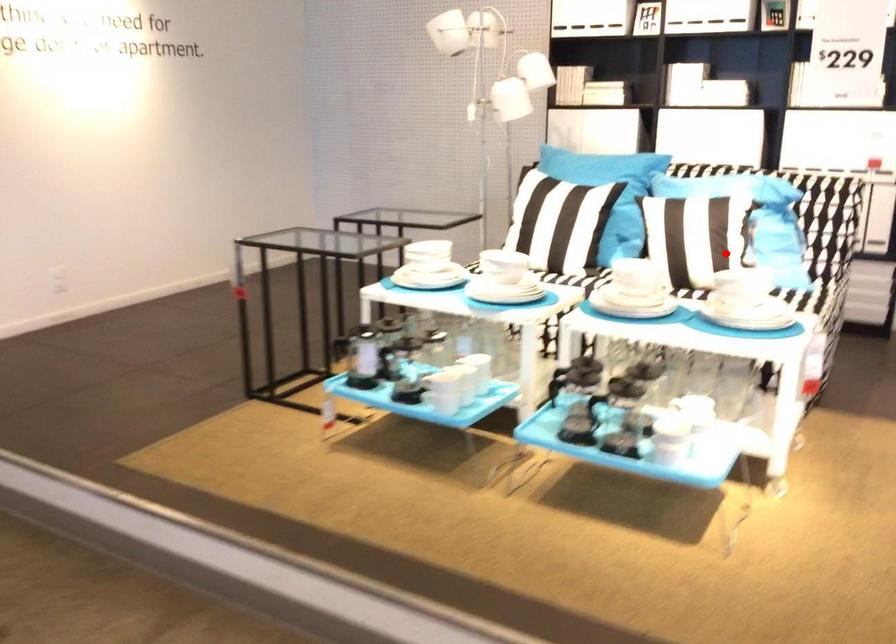
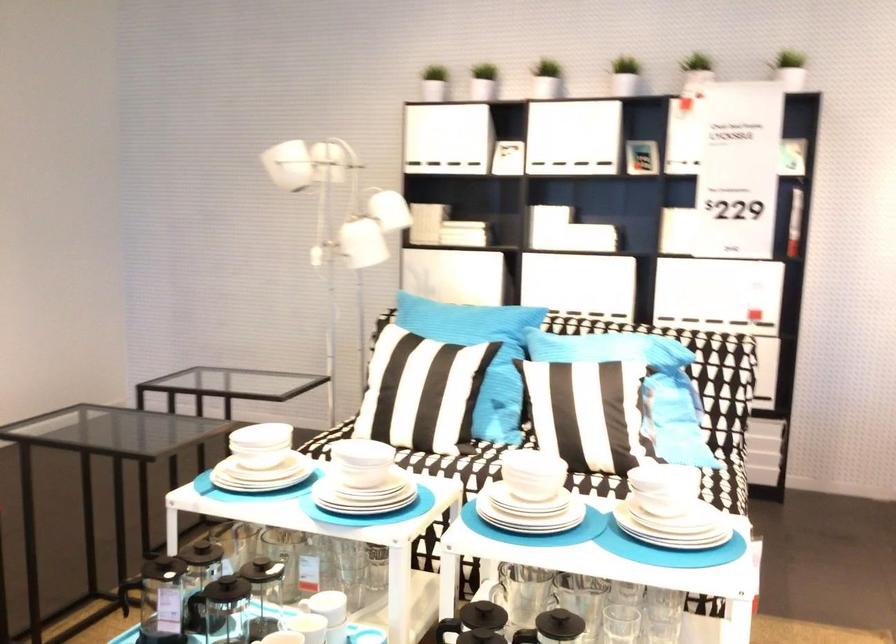
Find the pixel in the second image that matches the highlighted location in the first image.

(619, 442)